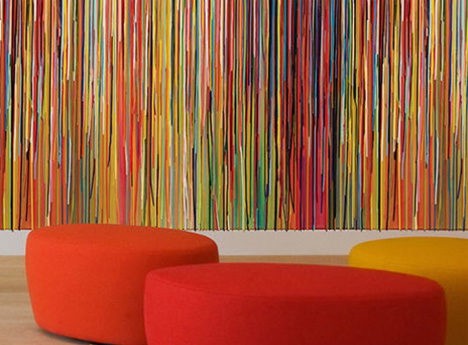
You are a GUI agent. You are given a task and a screenshot of the screen. Output one action in this format:
    pyautogui.click(x=<x>, y=<y>)
    Task: Click on the wall
    This screenshot has width=468, height=345.
    Given the screenshot: What is the action you would take?
    pyautogui.click(x=328, y=248)